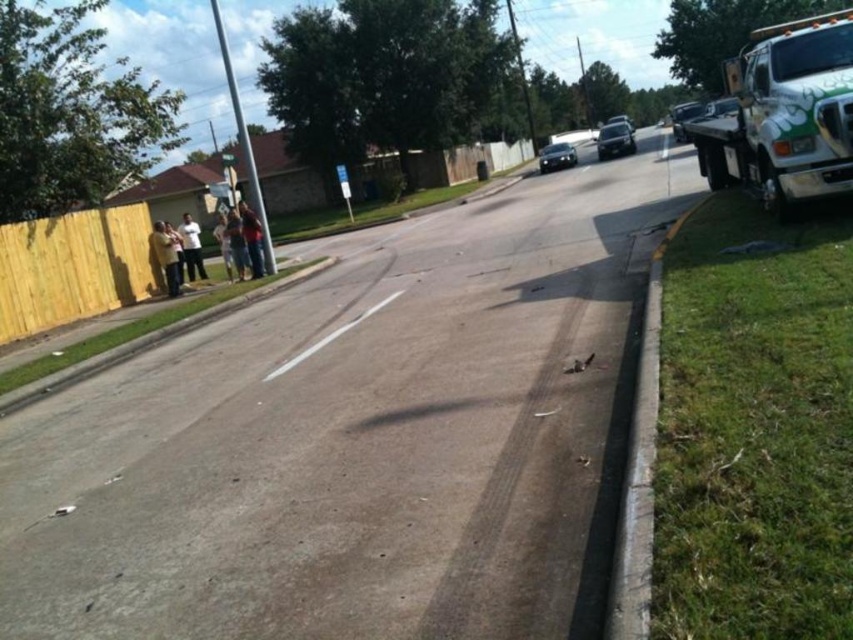
You are standing at the point marked by the coordinates point (259, 260) in this suburban street scene. You want to walk to the white utility truck parked on the right side of the road. How far will you have to walk to reach the truck?

The distance between the point (259, 260) and the viewer is 12.55 meters. However, the question asks for the distance to the white utility truck parked on the right side of the road. Since the truck is on the right side of the road and the point is at coordinates (259, 260), the exact distance to the truck would require additional spatial information not provided in the Objects Description. Therefore, the answer cannot be determined with the given data.

You are a pedestrian standing at the point marked by the coordinate point at (x=235, y=257). You want to cross the road to the sidewalk on the opposite side. The road is 12.59 meters wide. Can you safely cross the road in one go without stopping?

The road is 12.59 meters wide, so it is possible to cross the road in one go without stopping if you can cover that distance safely. However, you should always check for traffic and ensure it is safe before crossing.